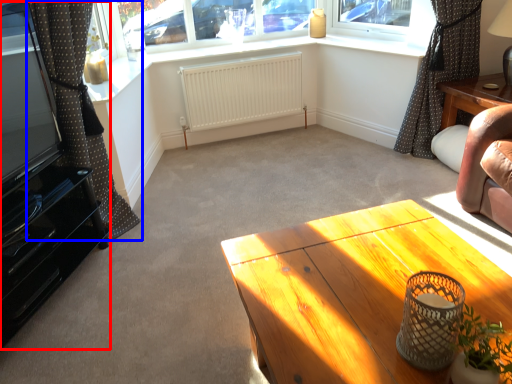
Question: Which of the following is the farthest to the observer, entertainment center (highlighted by a red box) or curtain (highlighted by a blue box)?

Choices:
 (A) entertainment center
 (B) curtain

Answer: (B)